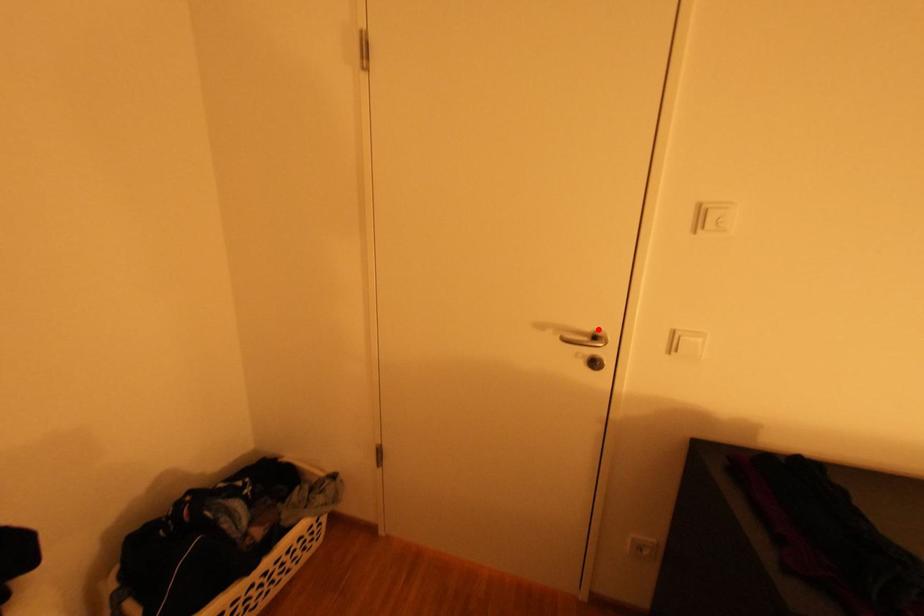
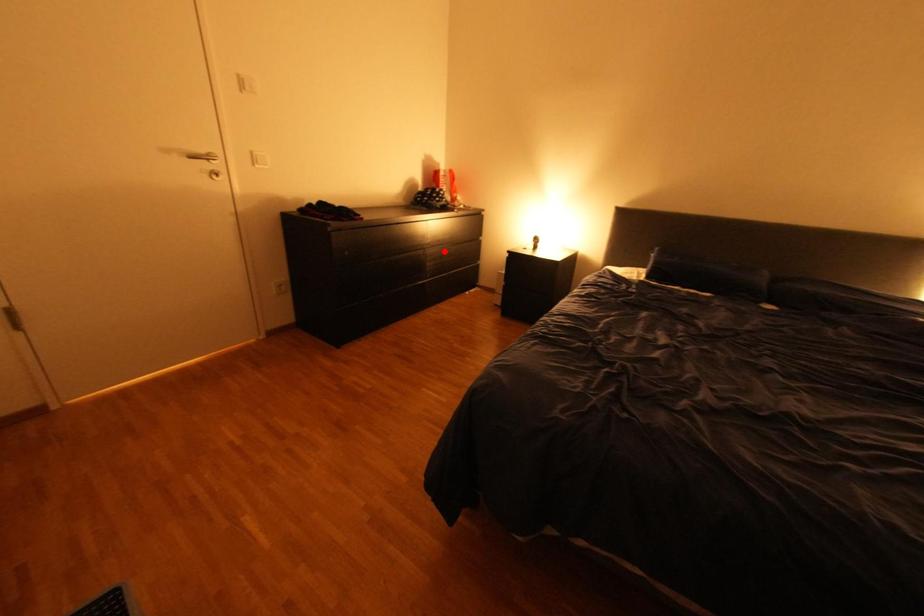
I am providing you with two images of the same scene from different viewpoints. A red point is marked on the first image and another point is marked on the second image. Does the point marked in image1 correspond to the same location as the one in image2?

No